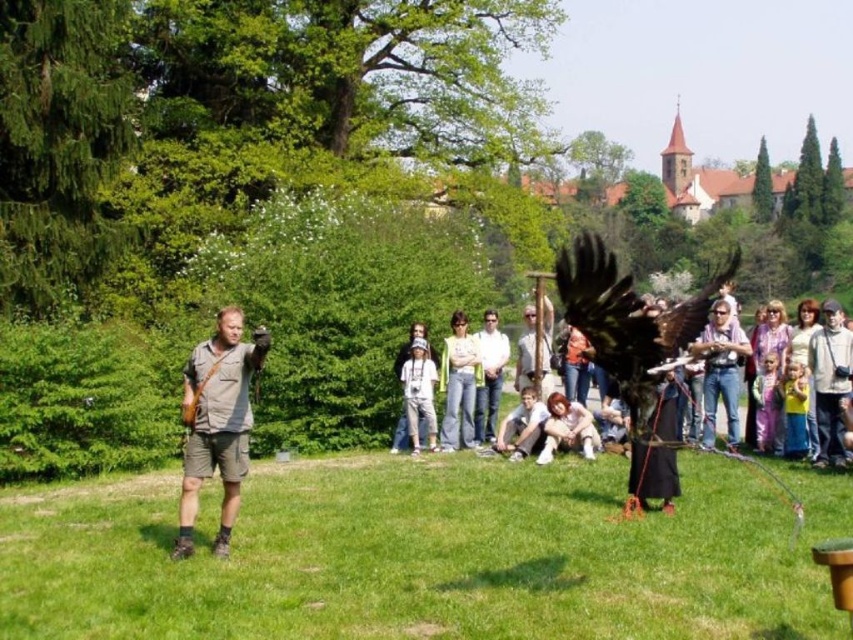
Is shiny black falcon at center further to camera compared to light brown denim jeans at center?

No, shiny black falcon at center is closer to the viewer.

In order to click on shiny black falcon at center in this screenshot , I will do `click(635, 353)`.

Image resolution: width=853 pixels, height=640 pixels. I want to click on shiny black falcon at center, so click(635, 353).

Can you confirm if shiny black falcon at center is taller than light brown hair at lower center?

Yes.

Is shiny black falcon at center wider than light brown hair at lower center?

Yes, shiny black falcon at center is wider than light brown hair at lower center.

Does point (660, 352) lie behind point (553, 397)?

No, (660, 352) is in front of (553, 397).

Image resolution: width=853 pixels, height=640 pixels. I want to click on shiny black falcon at center, so click(635, 353).

Which of these two, light gray cotton shirt at center or light brown hair at lower center, stands taller?

light gray cotton shirt at center

Image resolution: width=853 pixels, height=640 pixels. What do you see at coordinates (419, 394) in the screenshot?
I see `light gray cotton shirt at center` at bounding box center [419, 394].

Where is `light gray cotton shirt at center`? light gray cotton shirt at center is located at coordinates [x=419, y=394].